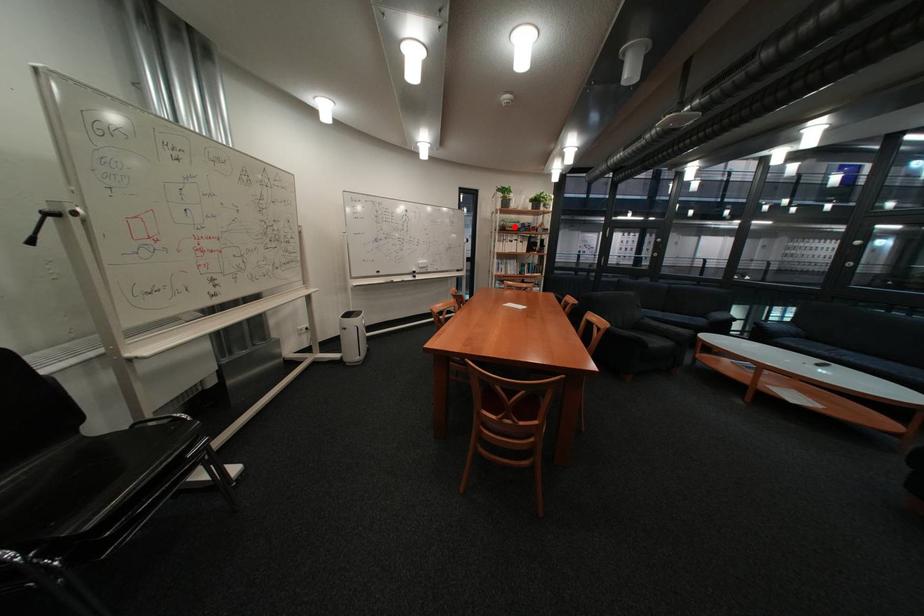
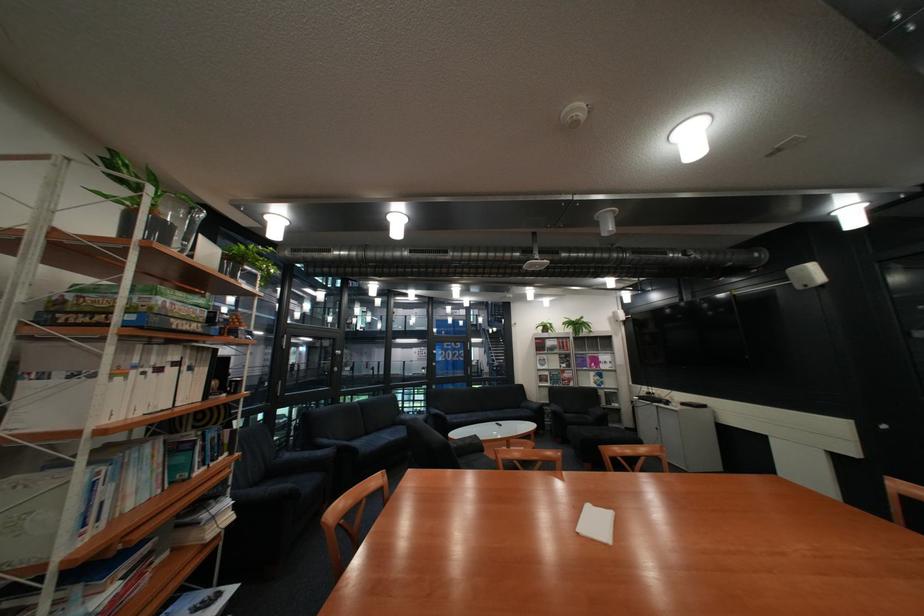
The point at the highlighted location is marked in the first image. Where is the corresponding point in the second image?

(141, 312)